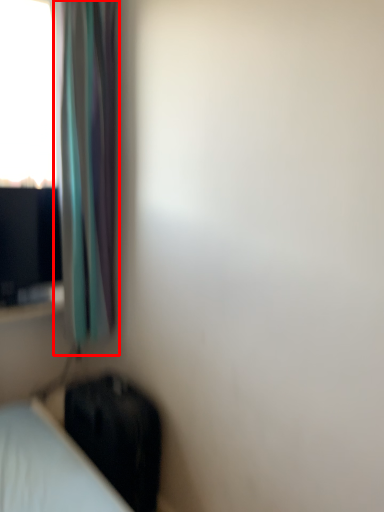
Question: Considering the relative positions of curtain (annotated by the red box) and luggage in the image provided, where is curtain (annotated by the red box) located with respect to the staircase?

Choices:
 (A) right
 (B) left

Answer: (B)